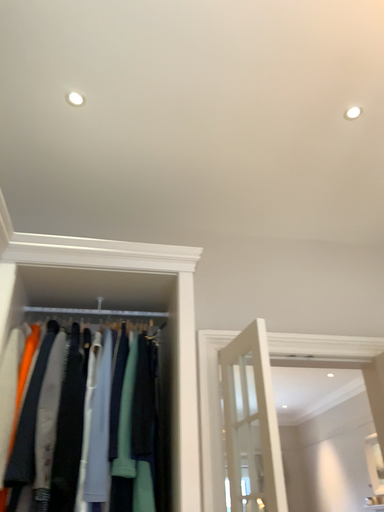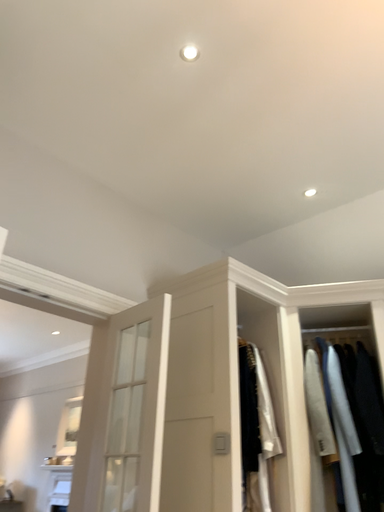
Question: Which way did the camera rotate in the video?

Choices:
 (A) rotated downward
 (B) rotated upward

Answer: (A)